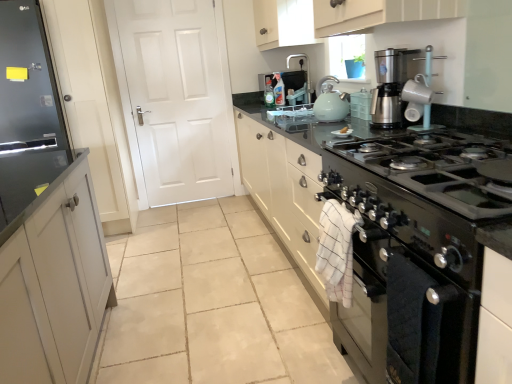
Question: In the image, is black glass stove at center on the left side or the right side of blue plastic pot at upper center?

Choices:
 (A) right
 (B) left

Answer: (B)

Question: Based on their sizes in the image, would you say black glass stove at center is bigger or smaller than blue plastic pot at upper center?

Choices:
 (A) big
 (B) small

Answer: (A)

Question: Which object is positioned farthest from the black stainless steel oven at lower right?

Choices:
 (A) white glossy plate at center
 (B) matte white mug at upper right
 (C) blue plastic pot at upper center
 (D) black glass stove at center
 (E) matte silver faucet at upper center

Answer: (E)

Question: Which is nearer to the matte silver faucet at upper center?

Choices:
 (A) white glossy plate at center
 (B) matte teal kettle at upper center
 (C) black glass stove at center
 (D) matte white mug at upper right
 (E) black stainless steel oven at lower right

Answer: (B)